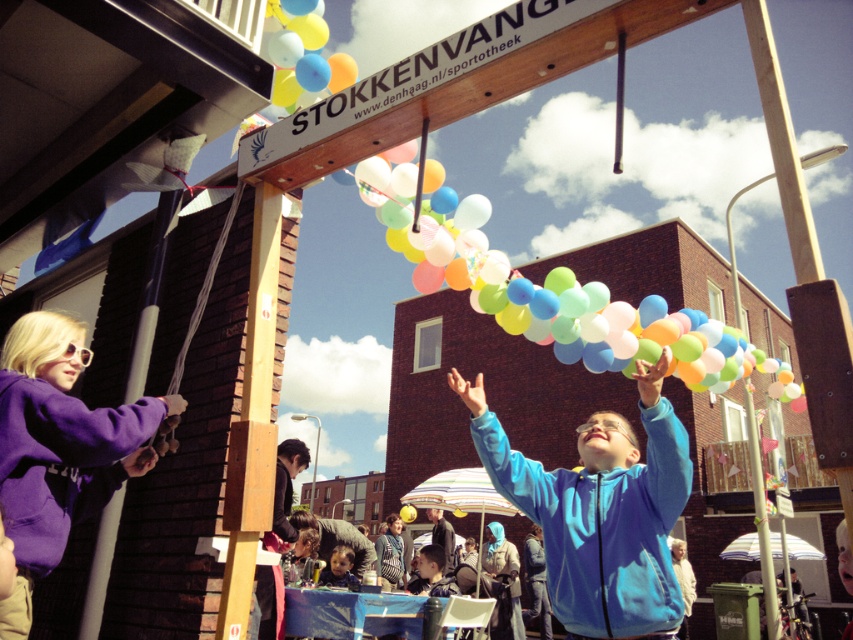
Does blue matte jacket at center appear under pastel balloons at center?

Correct, blue matte jacket at center is located below pastel balloons at center.

From the picture: How far apart are blue matte jacket at center and pastel balloons at center?

They are 3.46 meters apart.

Between point (579, 612) and point (428, 256), which one is positioned behind?

Point (428, 256)

At what (x,y) coordinates should I click in order to perform the action: click on blue matte jacket at center. Please return your answer as a coordinate pair (x, y). Image resolution: width=853 pixels, height=640 pixels. Looking at the image, I should click on (601, 509).

Between point (628, 570) and point (343, 573), which one is positioned behind?

The point (343, 573) is behind.

Based on the photo, does blue matte jacket at center have a greater width compared to matte blue hoodie at center?

Indeed, blue matte jacket at center has a greater width compared to matte blue hoodie at center.

Does point (625, 432) come behind point (334, 580)?

No, it is in front of (334, 580).

Find the location of a particular element. This screenshot has height=640, width=853. blue matte jacket at center is located at coordinates 601,509.

Can you confirm if pastel balloons at center is thinner than matte blue hoodie at center?

In fact, pastel balloons at center might be wider than matte blue hoodie at center.

Describe the element at coordinates (538, 300) in the screenshot. I see `pastel balloons at center` at that location.

At what (x,y) coordinates should I click in order to perform the action: click on pastel balloons at center. Please return your answer as a coordinate pair (x, y). Image resolution: width=853 pixels, height=640 pixels. Looking at the image, I should click on (538, 300).